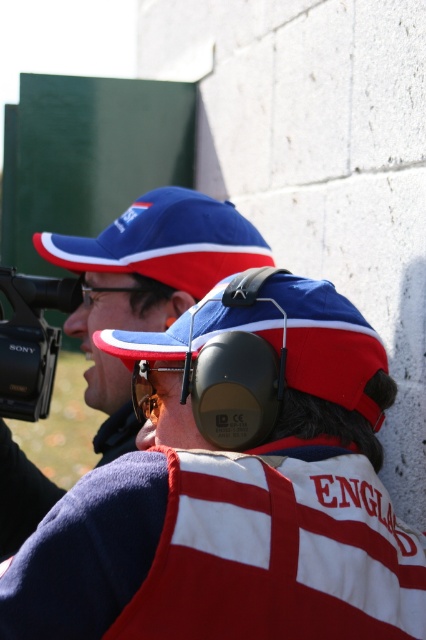
You are a photographer positioned at the back of the scene. You want to capture a clear photo of the matte black ear protection at center without the black plastic camera at left blocking it. Is this possible based on their positions?

The matte black ear protection at center is in front of the black plastic camera at left, so the camera will be behind the ear protection and not block the view. Therefore, you can capture a clear photo of the matte black ear protection at center without obstruction.

You are a photographer positioned at the camera location. You need to focus your lens on either the point at coordinate point (x=111, y=440) or the point at coordinate point (x=57, y=346). Which point should you focus on to ensure it appears clearer in the photo?

You should focus on point (x=111, y=440) because it is closer to the camera and will appear clearer in the photo.

You are standing in the shooting range and see the point at coordinates (344, 298). If you want to place a target 1.5 meters away from you, is this point suitable?

The point at coordinates (344, 298) is 1.44 meters from the viewer, which is slightly closer than the desired 1.5 meters. Therefore, it may not be suitable if precise distance is required.